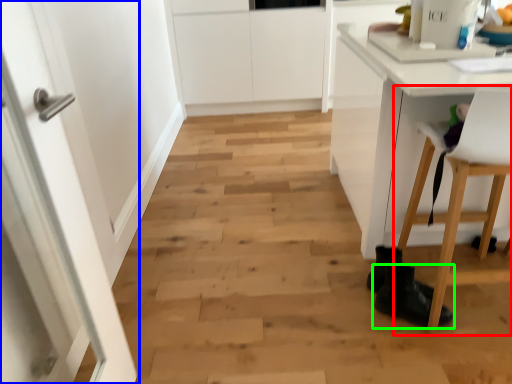
Question: Which is nearer to the chair (highlighted by a red box)? door (highlighted by a blue box) or footwear (highlighted by a green box).

Choices:
 (A) door
 (B) footwear

Answer: (B)